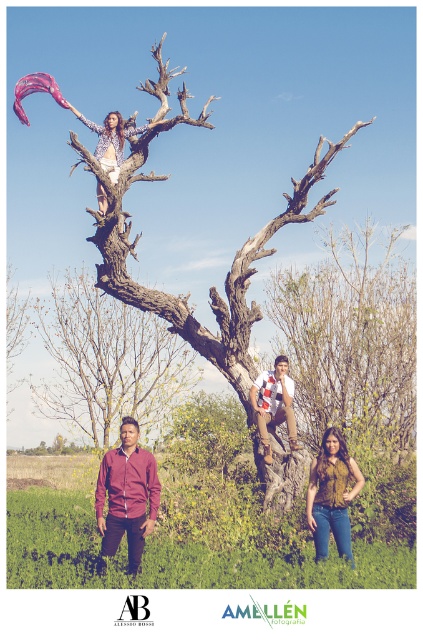
Measure the distance from maroon shirt at center to white cotton shirt at center.

The distance of maroon shirt at center from white cotton shirt at center is 3.28 meters.

Is point (134, 560) farther from camera compared to point (279, 419)?

No, it is not.

Locate an element on the screen. The image size is (423, 640). maroon shirt at center is located at coordinates (126, 496).

Which is below, smooth bark tree at center or maroon shirt at center?

maroon shirt at center is below.

Is point (62, 333) less distant than point (151, 525)?

No, (62, 333) is behind (151, 525).

Locate an element on the screen. This screenshot has height=640, width=423. smooth bark tree at center is located at coordinates (107, 360).

Is bare wood tree at center taller than white cotton shirt at center?

Indeed, bare wood tree at center has a greater height compared to white cotton shirt at center.

Does bare wood tree at center have a smaller size compared to white cotton shirt at center?

Actually, bare wood tree at center might be larger than white cotton shirt at center.

Who is more distant from viewer, (382, 420) or (271, 420)?

Positioned behind is point (382, 420).

Locate an element on the screen. bare wood tree at center is located at coordinates (351, 340).